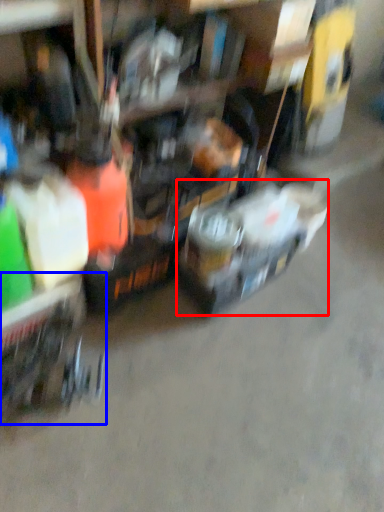
Question: Which of the following is the closest to the observer, vehicle (highlighted by a red box) or trolley (highlighted by a blue box)?

Choices:
 (A) vehicle
 (B) trolley

Answer: (B)